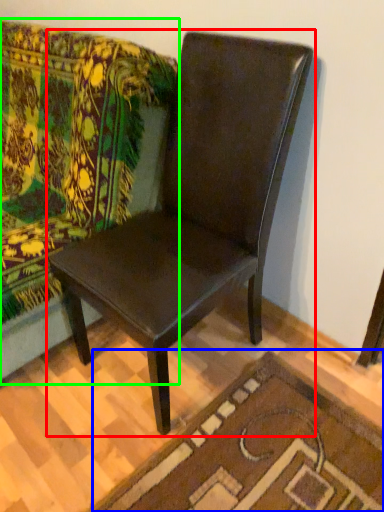
Question: Which is farther away from chair (highlighted by a red box)? doormat (highlighted by a blue box) or studio couch (highlighted by a green box)?

Choices:
 (A) doormat
 (B) studio couch

Answer: (A)